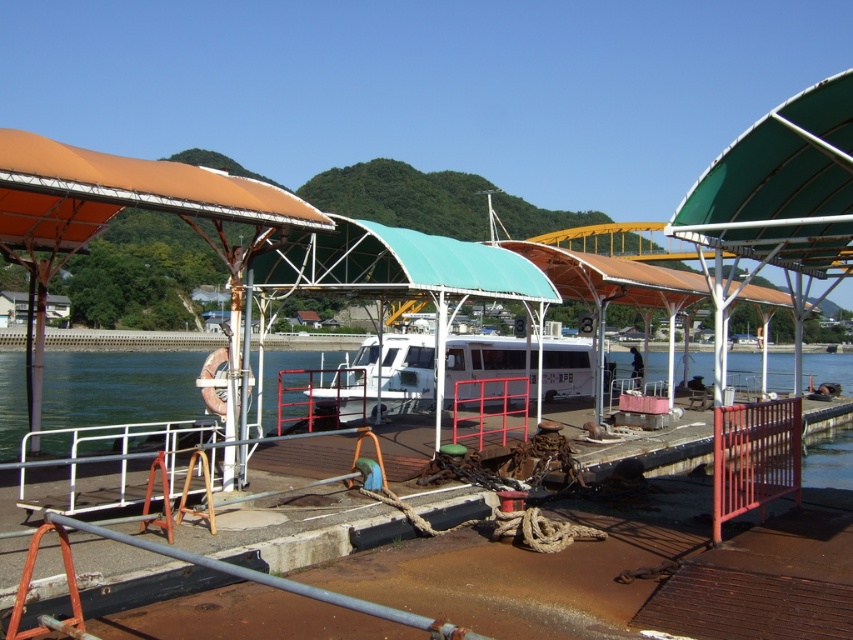
Can you confirm if clear water at lower left is positioned to the left of white matte boat at center?

Yes, clear water at lower left is to the left of white matte boat at center.

Between point (115, 420) and point (401, 369), which one is positioned in front?

Point (401, 369) is in front.

This screenshot has width=853, height=640. What are the coordinates of `clear water at lower left` in the screenshot? It's located at (120, 387).